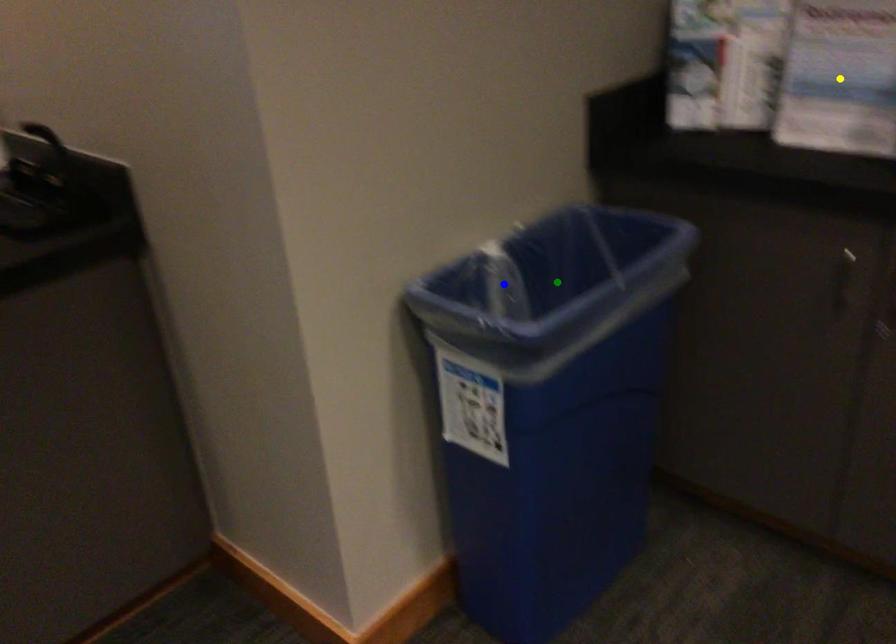
Order these from nearest to farthest:
yellow point
green point
blue point

green point
yellow point
blue point